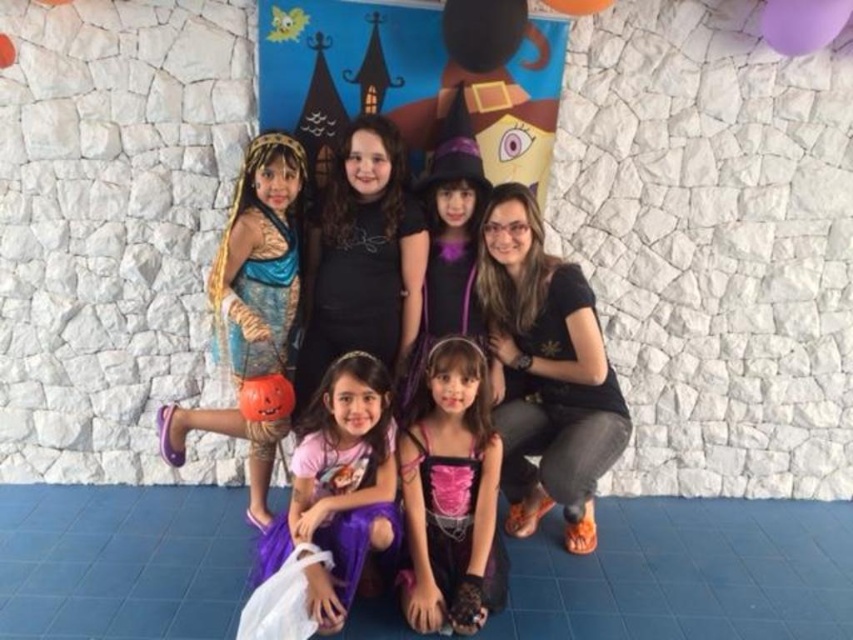
Can you confirm if black matte dress at center is positioned to the right of shiny gold costume at left?

Yes, black matte dress at center is to the right of shiny gold costume at left.

Is black matte dress at center taller than shiny gold costume at left?

In fact, black matte dress at center may be shorter than shiny gold costume at left.

Measure the distance between black matte dress at center and camera.

They are 2.60 meters apart.

This screenshot has width=853, height=640. I want to click on black matte dress at center, so point(361,259).

Does matte purple dress at center appear over black matte shirt at center?

Yes.

Does matte purple dress at center appear on the left side of black matte shirt at center?

Indeed, matte purple dress at center is positioned on the left side of black matte shirt at center.

Is point (225, 259) closer to camera compared to point (537, 246)?

That is True.

The height and width of the screenshot is (640, 853). In order to click on matte purple dress at center in this screenshot , I will do `click(392, 250)`.

Between point (581, 276) and point (469, 580), which one is positioned in front?

Point (469, 580)

Who is more forward, [581,346] or [426,356]?

Point [581,346]

This screenshot has height=640, width=853. I want to click on black matte shirt at center, so click(x=546, y=371).